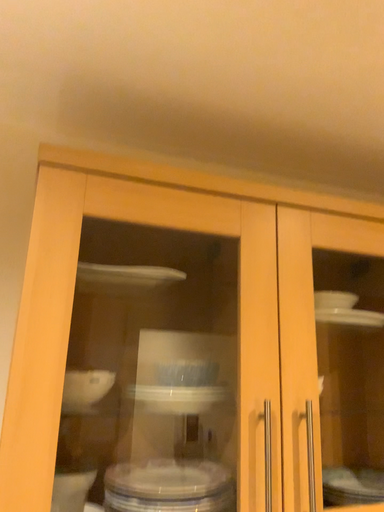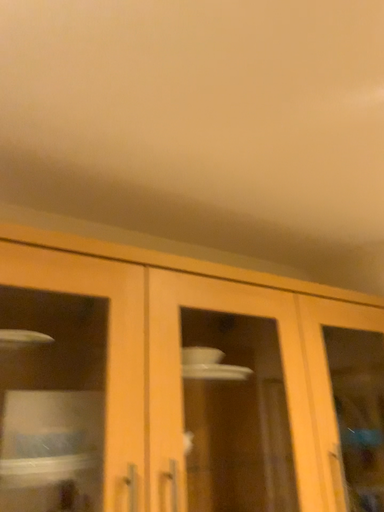
Question: Which way did the camera rotate in the video?

Choices:
 (A) rotated downward
 (B) rotated upward

Answer: (B)